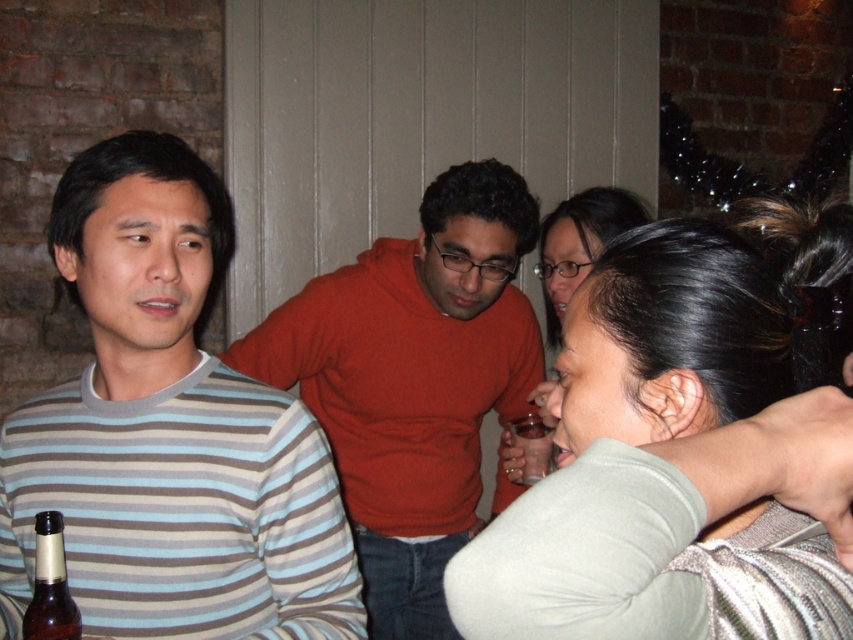
Question: Is the position of matte orange sweater at center more distant than that of matte gray sweater at center?

Choices:
 (A) no
 (B) yes

Answer: (B)

Question: Which point is farther to the camera?

Choices:
 (A) striped cotton shirt at left
 (B) dark gray sweater at lower right

Answer: (A)

Question: Which point is farther to the camera?

Choices:
 (A) matte orange sweater at center
 (B) dark gray sweater at lower right
 (C) translucent plastic cup at lower center

Answer: (A)

Question: Among these objects, which one is nearest to the camera?

Choices:
 (A) matte orange sweater at center
 (B) dark gray sweater at lower right
 (C) matte gray sweater at center

Answer: (B)

Question: Does dark gray sweater at lower right appear on the left side of translucent plastic cup at lower center?

Choices:
 (A) yes
 (B) no

Answer: (B)

Question: Is matte orange sweater at center wider than translucent plastic cup at lower center?

Choices:
 (A) no
 (B) yes

Answer: (B)